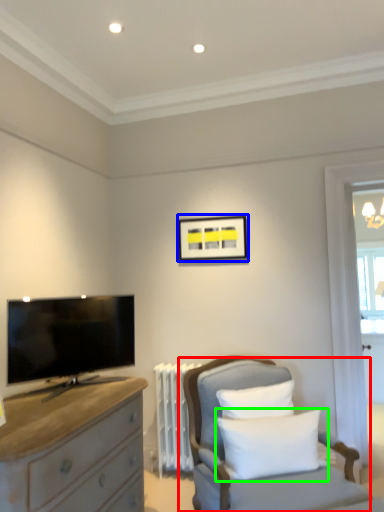
Question: Which object is the closest to the chair (highlighted by a red box)? Choose among these: picture frame (highlighted by a blue box) or pillow (highlighted by a green box).

Choices:
 (A) picture frame
 (B) pillow

Answer: (B)